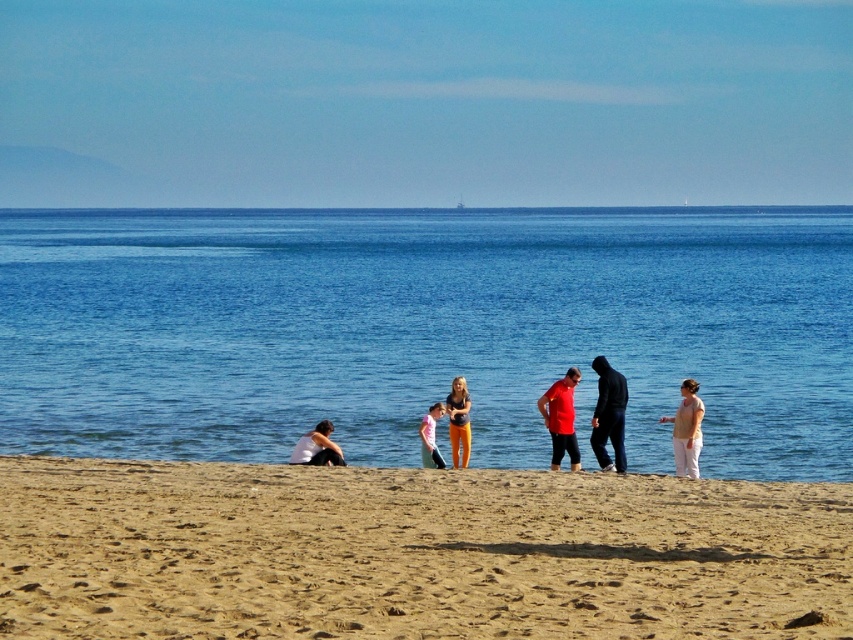
Does light beige cotton shirt at center have a lesser height compared to light pink fabric dress at center?

No, light beige cotton shirt at center is not shorter than light pink fabric dress at center.

Can you confirm if light beige cotton shirt at center is taller than light pink fabric dress at center?

Indeed, light beige cotton shirt at center has a greater height compared to light pink fabric dress at center.

I want to click on light beige cotton shirt at center, so click(x=686, y=429).

The image size is (853, 640). Identify the location of light beige cotton shirt at center. (686, 429).

The width and height of the screenshot is (853, 640). What do you see at coordinates (412, 552) in the screenshot?
I see `fine-grained sand at lower center` at bounding box center [412, 552].

Is fine-grained sand at lower center smaller than matte red shirt at center?

Actually, fine-grained sand at lower center might be larger than matte red shirt at center.

You are a GUI agent. You are given a task and a screenshot of the screen. Output one action in this format:
    pyautogui.click(x=<x>, y=<y>)
    Task: Click on the fine-grained sand at lower center
    The image size is (853, 640).
    Given the screenshot: What is the action you would take?
    coord(412,552)

This screenshot has width=853, height=640. What are the coordinates of `fine-grained sand at lower center` in the screenshot? It's located at (412, 552).

Which of these two, light beige cotton shirt at center or orange pants at center, stands taller?

orange pants at center is taller.

Identify the location of light beige cotton shirt at center. The height and width of the screenshot is (640, 853). (686, 429).